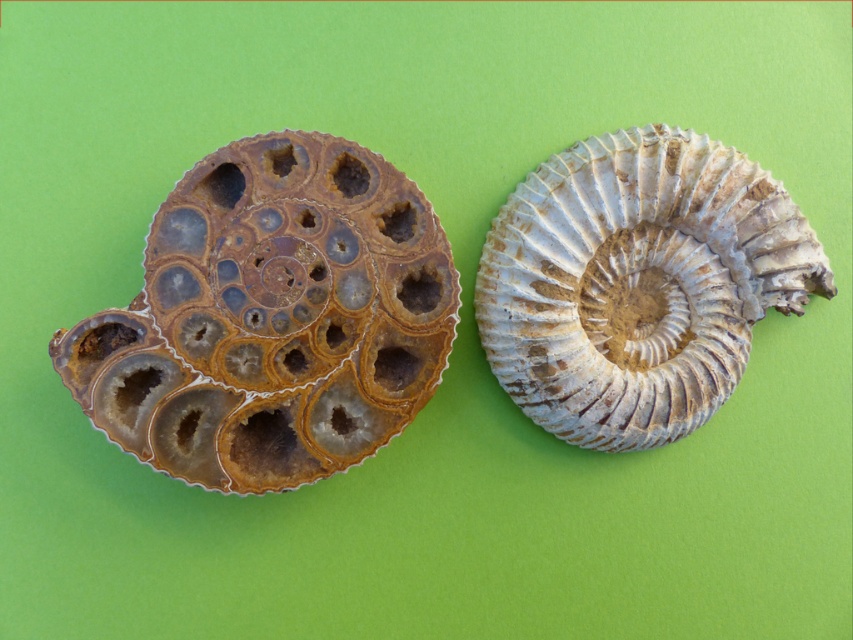
You are an archaeologist examining two fossils. You have a translucent amber fossil at left and a white textured fossil at center. Which fossil is wider?

The translucent amber fossil at left is wider than the white textured fossil at center.